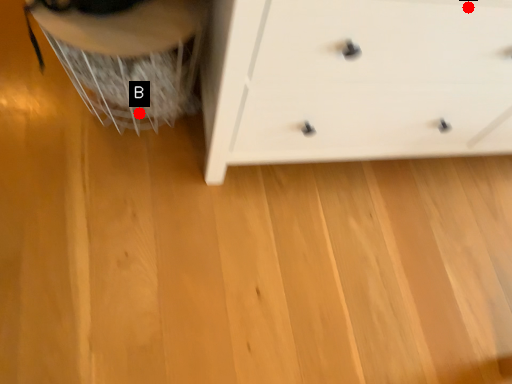
Question: Two points are circled on the image, labeled by A and B beside each circle. Which of the following is the farthest from the observer?

Choices:
 (A) A is further
 (B) B is further

Answer: (B)